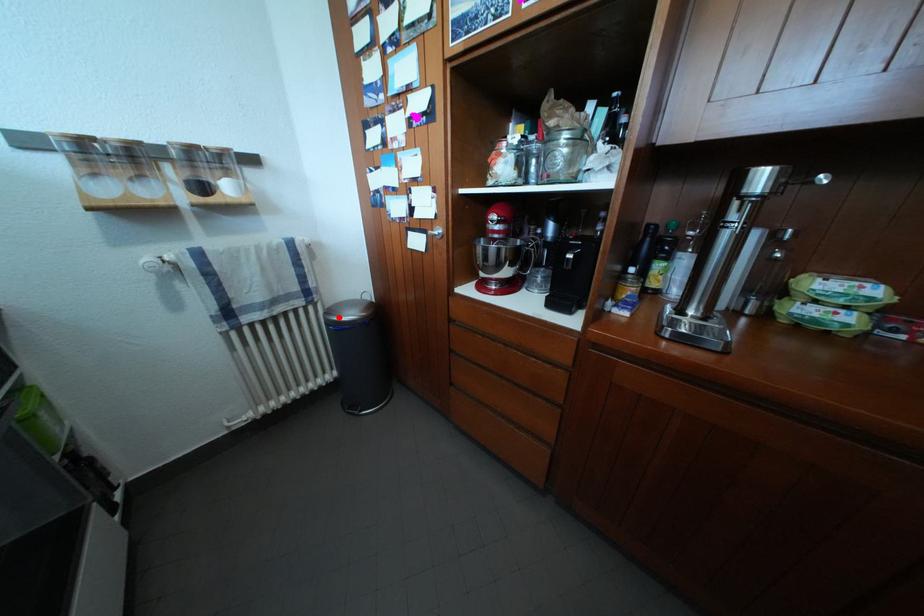
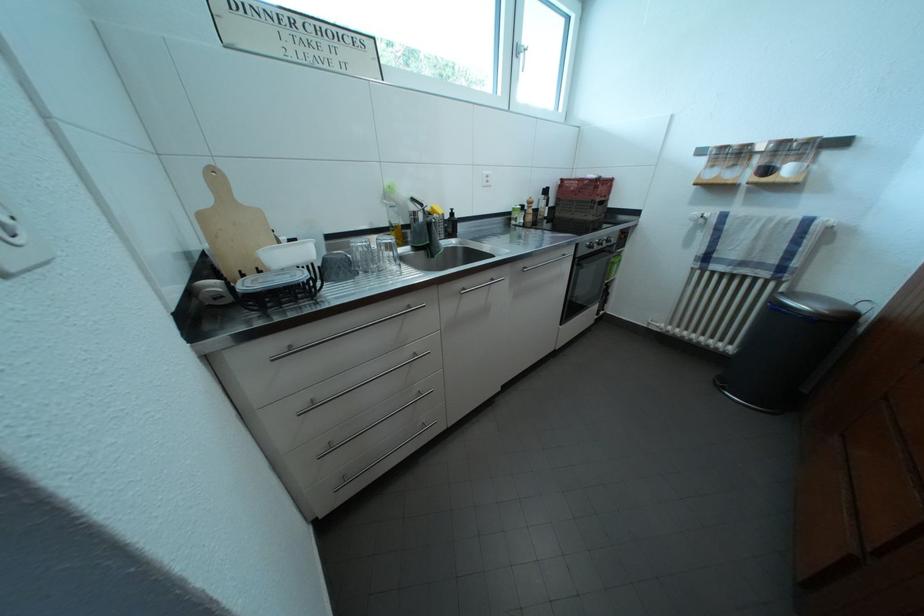
Locate, in the second image, the point that corresponds to the highlighted location in the first image.

(797, 301)